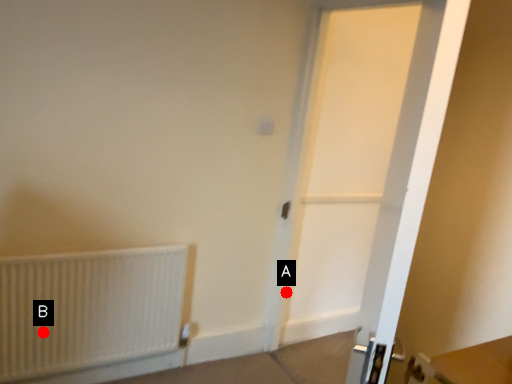
Question: Two points are circled on the image, labeled by A and B beside each circle. Which point is closer to the camera?

Choices:
 (A) A is closer
 (B) B is closer

Answer: (B)